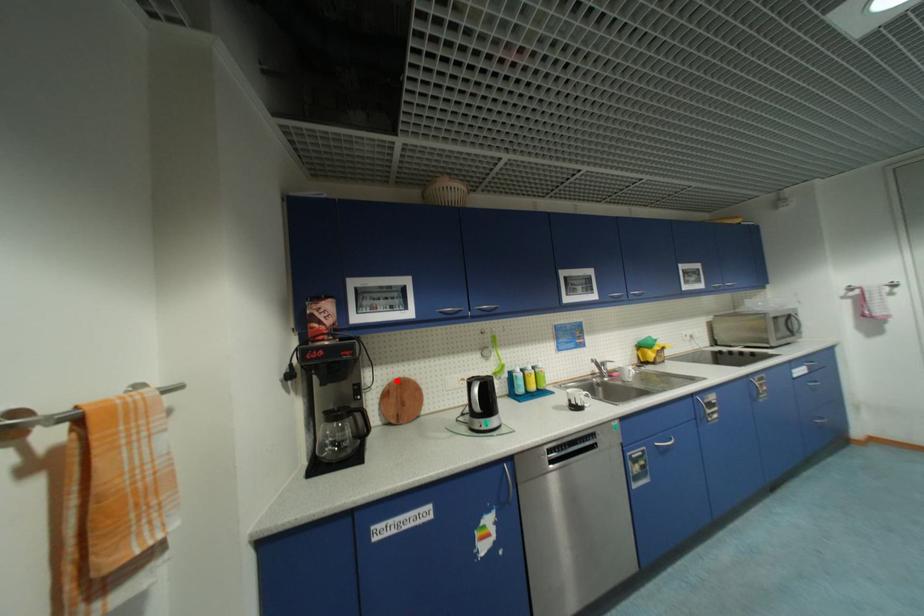
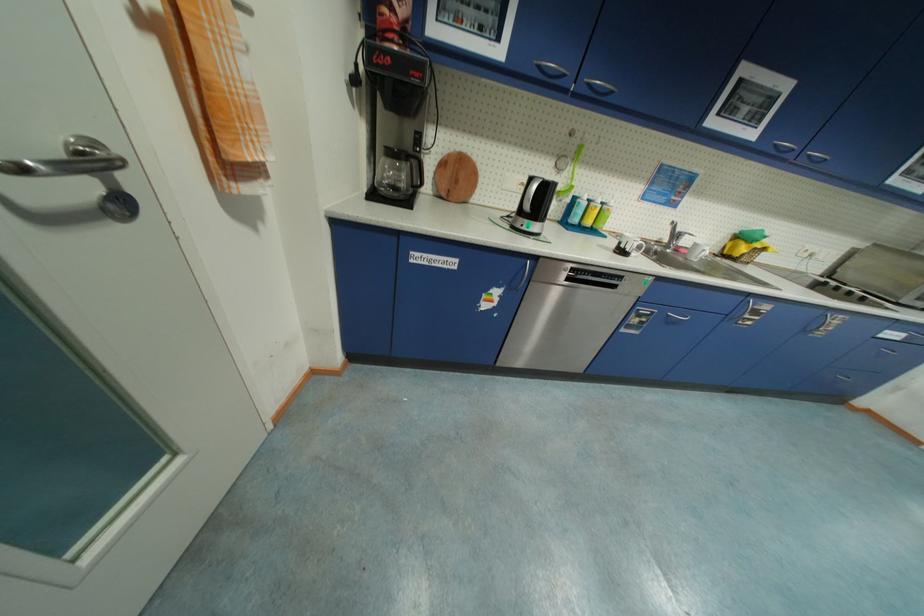
Locate, in the second image, the point that corresponds to the highlighted location in the first image.

(457, 151)